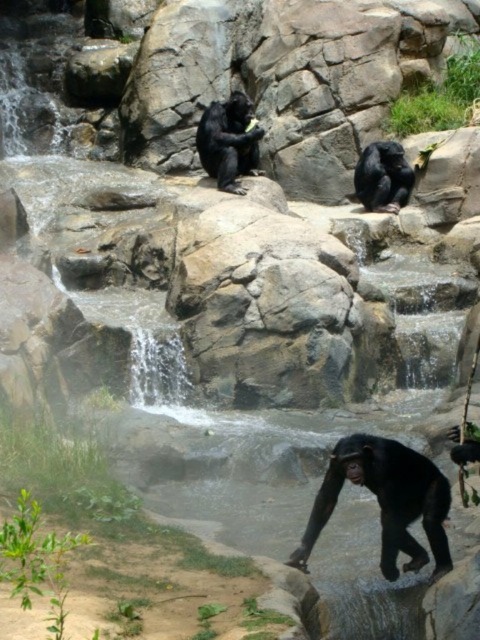
Question: Which is nearer to the black matte monkey at center?

Choices:
 (A) black matte monkey at upper center
 (B) black glossy monkey at lower center

Answer: (A)

Question: Which of the following is the closest to the observer?

Choices:
 (A) (238, 176)
 (B) (338, 486)

Answer: (B)

Question: Can you confirm if black matte monkey at center is smaller than black matte monkey at upper center?

Choices:
 (A) no
 (B) yes

Answer: (A)

Question: Is black matte monkey at center to the right of black matte monkey at upper center from the viewer's perspective?

Choices:
 (A) yes
 (B) no

Answer: (B)

Question: Which point appears closest to the camera in this image?

Choices:
 (A) (387, 186)
 (B) (352, 458)
 (C) (238, 113)

Answer: (B)

Question: Can you confirm if black glossy monkey at lower center is positioned to the right of black matte monkey at center?

Choices:
 (A) no
 (B) yes

Answer: (B)